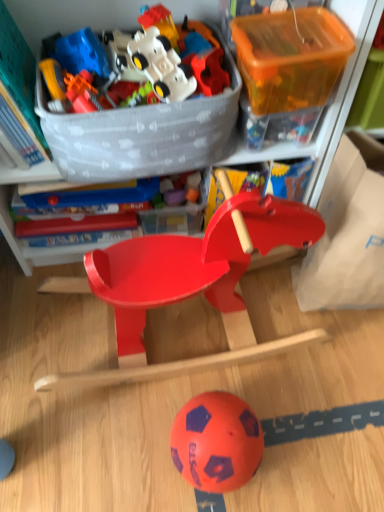
The height and width of the screenshot is (512, 384). In order to click on vacant area that is in front of matte plastic rocking horse at center, the 6th toy viewed from the top in this screenshot , I will do `click(163, 442)`.